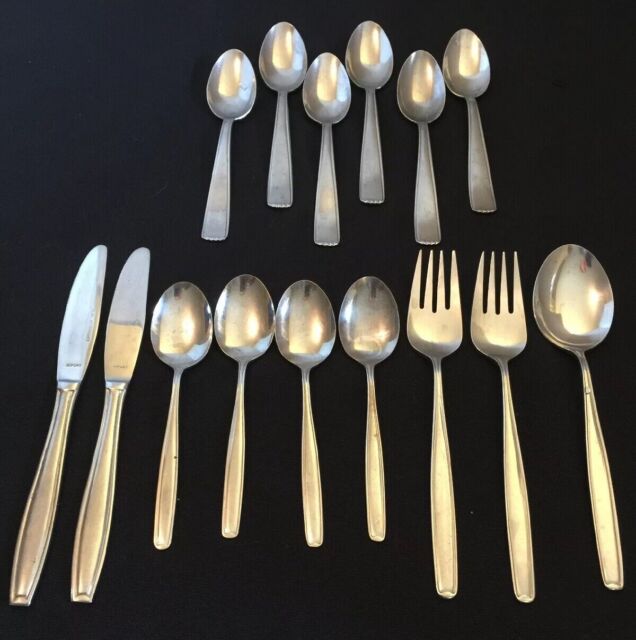
Locate an element on the screen. Image resolution: width=636 pixels, height=640 pixels. spoons on the bottom row is located at coordinates (194, 319), (230, 322), (308, 321), (375, 319), (581, 299).